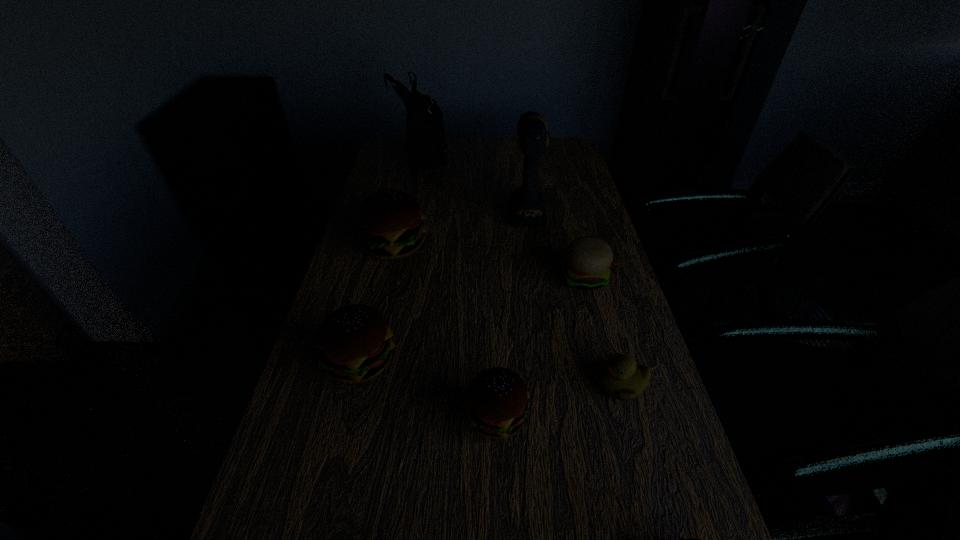
This screenshot has height=540, width=960. Identify the location of free space between the second biggest brown hamburger and the drill. (444, 285).

Locate an element on the screen. This screenshot has height=540, width=960. free space between the duckling and the drill is located at coordinates (574, 296).

Select which object appears as the closest to the smallest brown hamburger. Please provide its 2D coordinates. Your answer should be formatted as a tuple, i.e. [(x, y)], where the tuple contains the x and y coordinates of a point satisfying the conditions above.

[(497, 399)]

Identify which object is the fourth nearest to the third tallest object. Please provide its 2D coordinates. Your answer should be formatted as a tuple, i.e. [(x, y)], where the tuple contains the x and y coordinates of a point satisfying the conditions above.

[(588, 259)]

Point out which hamburger is positioned as the nearest to the smallest brown hamburger. Please provide its 2D coordinates. Your answer should be formatted as a tuple, i.e. [(x, y)], where the tuple contains the x and y coordinates of a point satisfying the conditions above.

[(497, 399)]

Select which hamburger appears as the closest to the duckling. Please provide its 2D coordinates. Your answer should be formatted as a tuple, i.e. [(x, y)], where the tuple contains the x and y coordinates of a point satisfying the conditions above.

[(497, 399)]

Choose which brown hamburger is the second nearest neighbor to the third brown hamburger from left to right. Please provide its 2D coordinates. Your answer should be formatted as a tuple, i.e. [(x, y)], where the tuple contains the x and y coordinates of a point satisfying the conditions above.

[(681, 539)]

Where is `brown hamburger that stands as the second closest to the nearest brown hamburger`? brown hamburger that stands as the second closest to the nearest brown hamburger is located at coordinates (354, 342).

Image resolution: width=960 pixels, height=540 pixels. Identify the location of vacant region that satisfies the following two spatial constraints: 1. on the front-facing side of the third hamburger from left to right; 2. on the right side of the brown shoulder bag. (372, 416).

Where is `free location that satisfies the following two spatial constraints: 1. with the drill bit of the drill facing forward; 2. on the front-facing side of the farthest object`? The image size is (960, 540). free location that satisfies the following two spatial constraints: 1. with the drill bit of the drill facing forward; 2. on the front-facing side of the farthest object is located at coordinates 518,156.